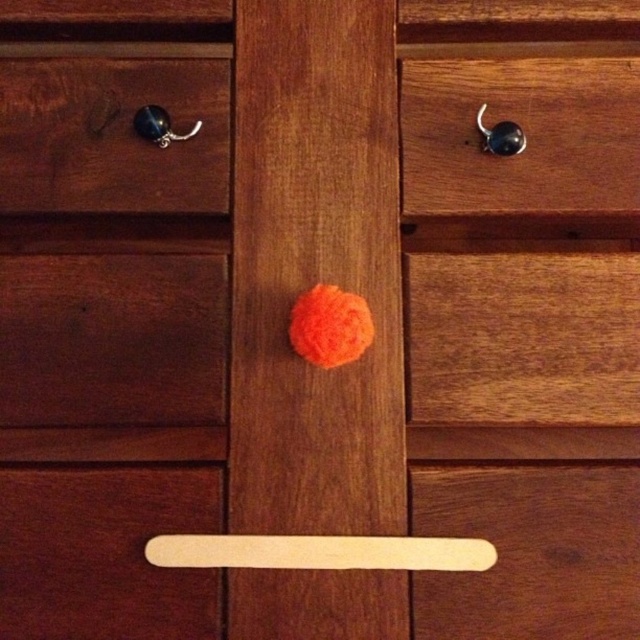
You are organizing a small shelf and have two items to place. You need to know which item is taller between the dark brown wood at lower left and the metallic hook at upper left. Which one is taller?

The dark brown wood at lower left is taller than the metallic hook at upper left according to the description.

You are organizing a small hook in your room and see the dark brown wood at lower left and the metallic hook at upper left. Which object is positioned more to the left side?

The dark brown wood at lower left is positioned to the left of the metallic hook at upper left, so the dark brown wood at lower left is more to the left side.

You are trying to place a small 1.5 inch wide sticker on the wooden furniture piece. The sticker must be placed exactly between the wooden at center and the matte black knob at upper left. Is there enough space for the sticker?

The wooden at center is 12.95 inches from the matte black knob at upper left. Since the sticker is only 1.5 inches wide, there is sufficient space between them to place it.